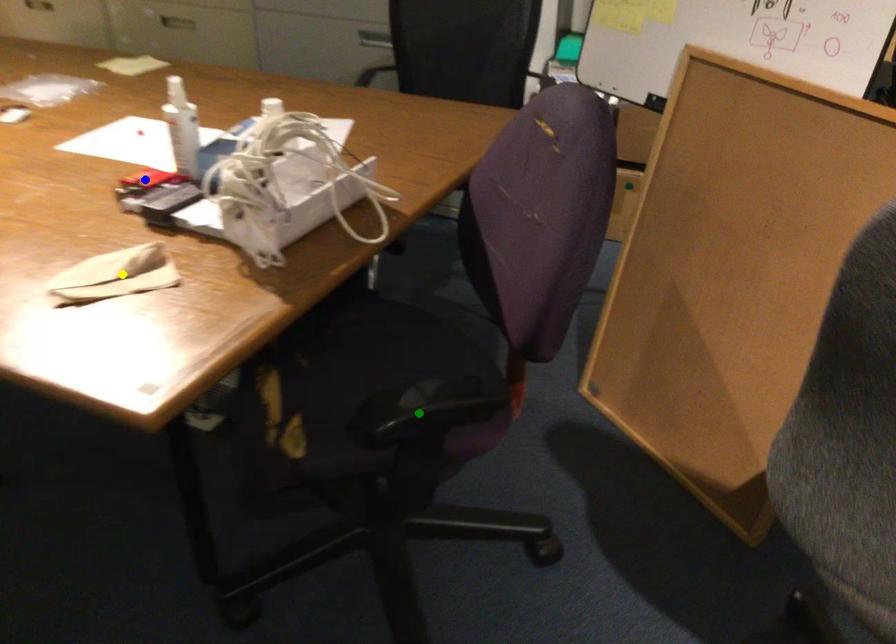
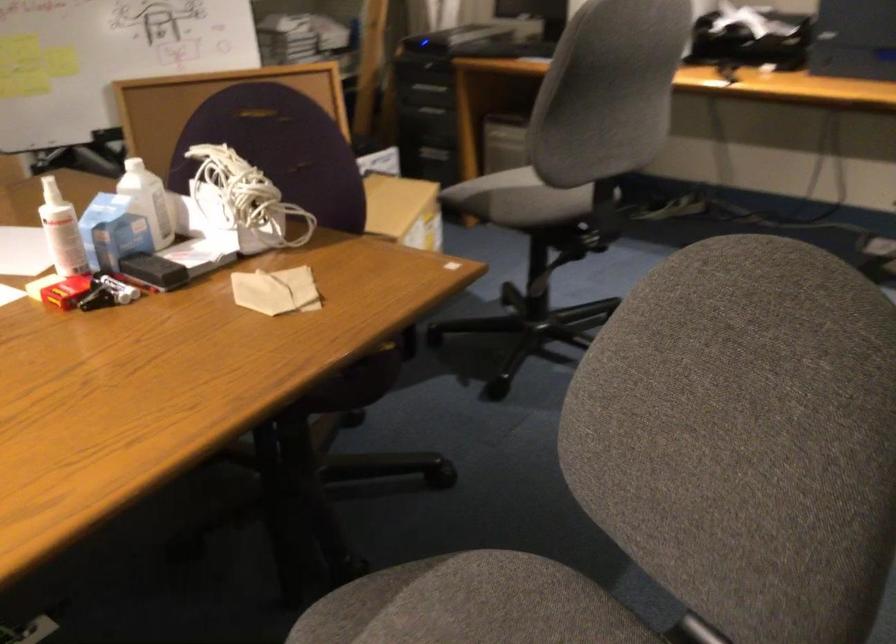
I am providing you with two images of the same scene from different viewpoints. Three points are marked in image1. Which point corresponds to a part or object that is occluded in image2?In image1, three points are marked. Which of them correspond to a part or object that is occluded in image2?Among the three points shown in image1, which one corresponds to a part or object that is no longer visible due to occlusion in image2?

green point cannot be seen in image2.